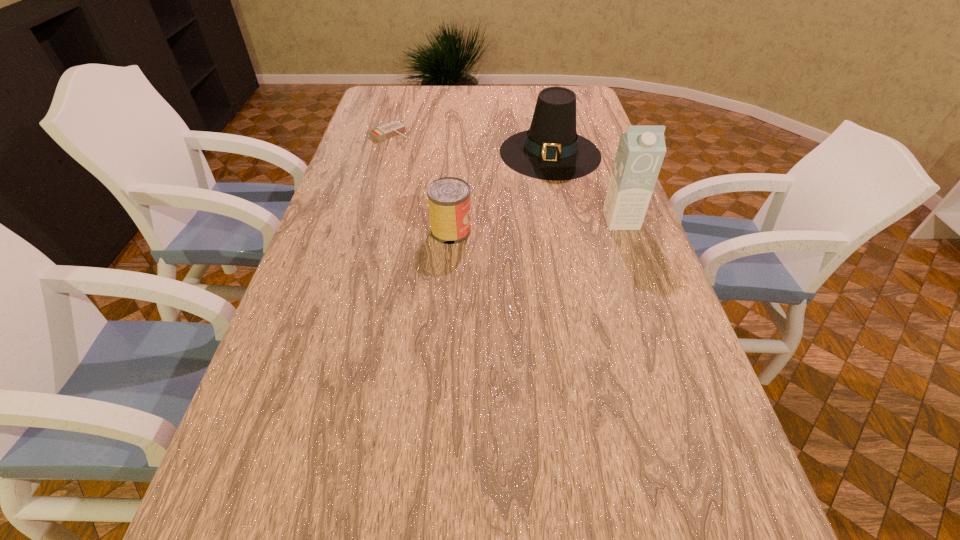
I want to click on vacant space located 0.060m on the striking surface of the matchbox, so click(x=409, y=147).

The width and height of the screenshot is (960, 540). In order to click on vacant space situated on the front-facing side of the second tallest object in this screenshot , I will do `click(537, 199)`.

In order to click on free space located 0.140m on the front-facing side of the second tallest object in this screenshot , I will do `click(535, 205)`.

This screenshot has width=960, height=540. Find the location of `free location located 0.390m on the front-facing side of the second tallest object`. free location located 0.390m on the front-facing side of the second tallest object is located at coordinates (519, 261).

Find the location of a particular element. This screenshot has width=960, height=540. object that is positioned at the left edge is located at coordinates (384, 132).

Image resolution: width=960 pixels, height=540 pixels. I want to click on carton located in the right edge section of the desktop, so click(x=640, y=153).

Where is `hat located at the right edge`? hat located at the right edge is located at coordinates (551, 149).

This screenshot has height=540, width=960. Identify the location of free spot at the far edge of the desktop. (467, 97).

The height and width of the screenshot is (540, 960). What are the coordinates of `free space at the near edge of the desktop` in the screenshot? It's located at (493, 479).

Find the location of a particular element. vacant region at the left edge is located at coordinates click(x=386, y=179).